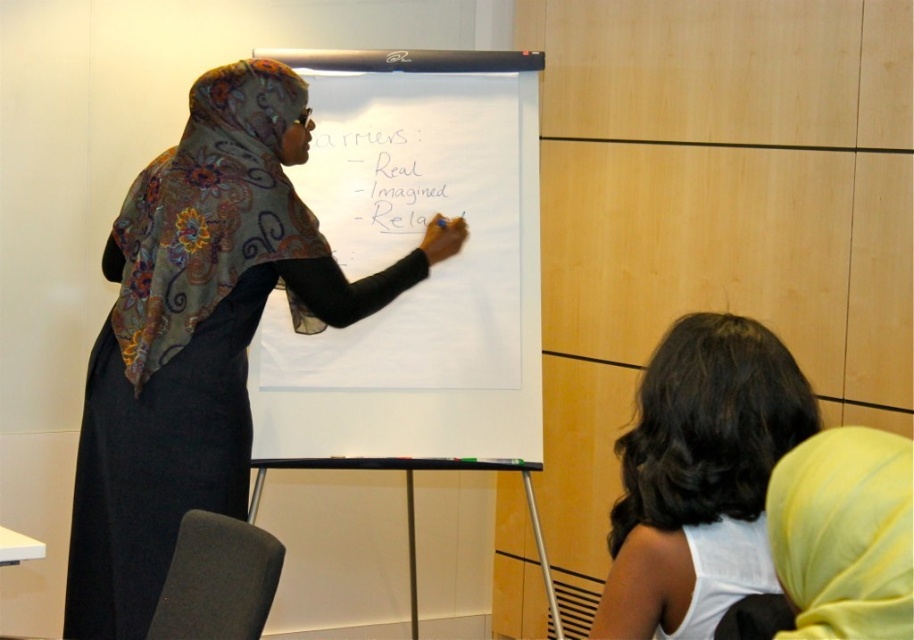
Consider the image. Does whiteboard at center have a smaller size compared to matte floral hijab at center?

Yes.

Does whiteboard at center appear over matte floral hijab at center?

Correct, whiteboard at center is located above matte floral hijab at center.

Image resolution: width=914 pixels, height=640 pixels. What do you see at coordinates (430, 275) in the screenshot?
I see `whiteboard at center` at bounding box center [430, 275].

Locate an element on the screen. whiteboard at center is located at coordinates (430, 275).

Does whiteboard at center have a lesser width compared to dark brown hair at lower right?

No.

Is the position of whiteboard at center more distant than that of dark brown hair at lower right?

Yes, it is behind dark brown hair at lower right.

Who is more forward, (389, 241) or (750, 538)?

Point (750, 538) is in front.

You are a GUI agent. You are given a task and a screenshot of the screen. Output one action in this format:
    pyautogui.click(x=<x>, y=<y>)
    Task: Click on the whiteboard at center
    This screenshot has width=914, height=640.
    Given the screenshot: What is the action you would take?
    pyautogui.click(x=430, y=275)

Can you confirm if matte floral hijab at center is thinner than dark brown hair at lower right?

No, matte floral hijab at center is not thinner than dark brown hair at lower right.

Locate an element on the screen. matte floral hijab at center is located at coordinates (199, 333).

What do you see at coordinates (199, 333) in the screenshot? I see `matte floral hijab at center` at bounding box center [199, 333].

Identify the location of matte floral hijab at center. (199, 333).